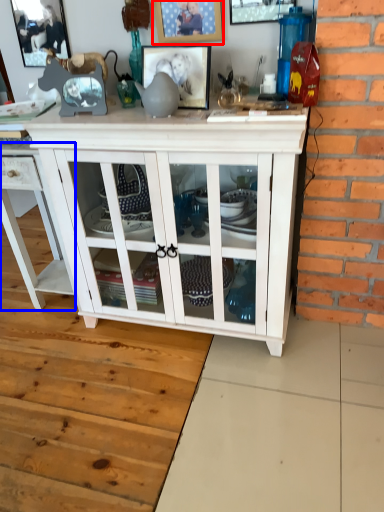
Question: Which point is closer to the camera, picture frame (highlighted by a red box) or cabinetry (highlighted by a blue box)?

Choices:
 (A) picture frame
 (B) cabinetry

Answer: (A)